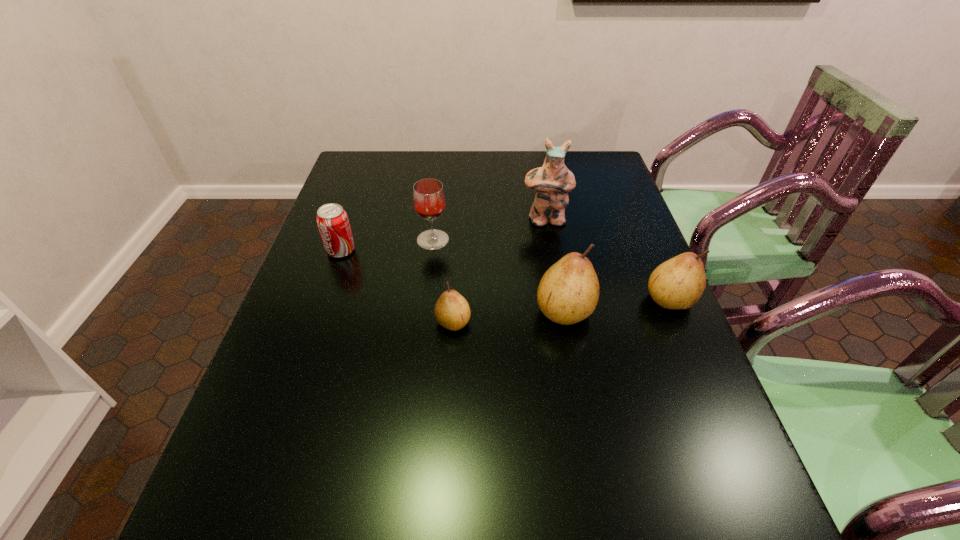
Locate an element on the screen. The image size is (960, 540). the shortest object is located at coordinates (452, 311).

Locate an element on the screen. This screenshot has width=960, height=540. the leftmost pear is located at coordinates (452, 311).

Image resolution: width=960 pixels, height=540 pixels. In order to click on the second pear from right to left in this screenshot , I will do `click(568, 293)`.

Where is `the rightmost object`? the rightmost object is located at coordinates (678, 283).

Find the location of a particular element. the second tallest pear is located at coordinates (678, 283).

This screenshot has width=960, height=540. I want to click on soda, so click(333, 223).

Locate an element on the screen. This screenshot has width=960, height=540. the leftmost object is located at coordinates (333, 223).

Where is `the tallest object`? The height and width of the screenshot is (540, 960). the tallest object is located at coordinates (552, 182).

This screenshot has height=540, width=960. Identify the location of the farthest object. (552, 182).

You are a GUI agent. You are given a task and a screenshot of the screen. Output one action in this format:
    pyautogui.click(x=<x>, y=<y>)
    Task: Click on the wineglass
    
    Given the screenshot: What is the action you would take?
    pyautogui.click(x=429, y=200)